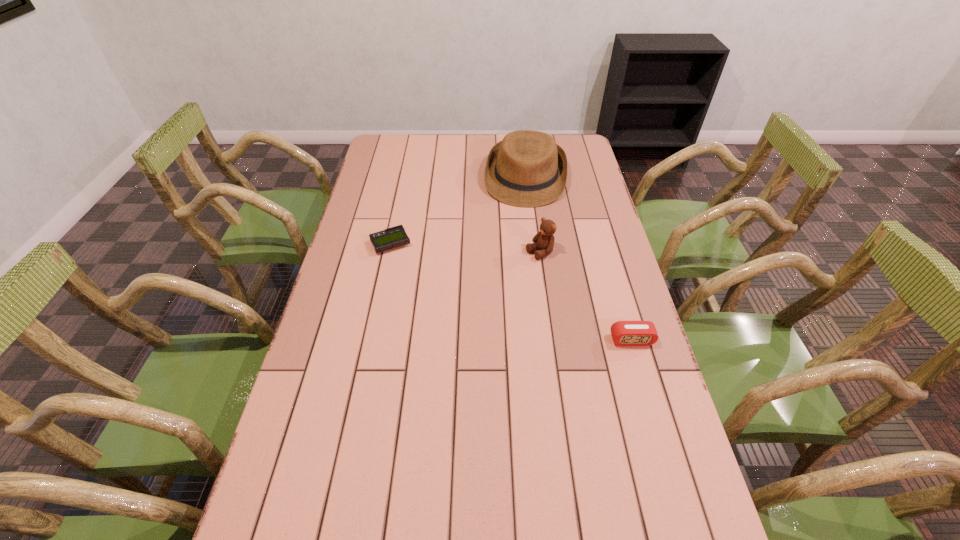
In the image, there is a desktop. Where is `vacant space at the right edge`? vacant space at the right edge is located at coordinates (569, 185).

Identify the location of vacant area at the far left corner. The height and width of the screenshot is (540, 960). (385, 160).

In the image, there is a desktop. Identify the location of vacant space at the near left corner. (338, 525).

What are the coordinates of `unoccupied position between the teddy bear and the shortest object` in the screenshot? It's located at (465, 248).

Locate an element on the screen. empty space between the third shortest object and the second shortest object is located at coordinates (586, 296).

You are a GUI agent. You are given a task and a screenshot of the screen. Output one action in this format:
    pyautogui.click(x=<x>, y=<y>)
    Task: Click on the free space between the second tallest object and the shortest object
    
    Given the screenshot: What is the action you would take?
    pyautogui.click(x=465, y=248)

The image size is (960, 540). I want to click on free space between the farthest object and the third tallest object, so click(x=578, y=259).

At what (x,y) coordinates should I click in order to perform the action: click on free space between the beeper and the farthest object. Please return your answer as a coordinate pair (x, y). This screenshot has width=960, height=540. Looking at the image, I should click on (458, 211).

The height and width of the screenshot is (540, 960). In order to click on empty location between the beeper and the rightmost object in this screenshot , I will do `click(511, 292)`.

Where is `free point between the teddy bear and the farthest object`? free point between the teddy bear and the farthest object is located at coordinates (533, 215).